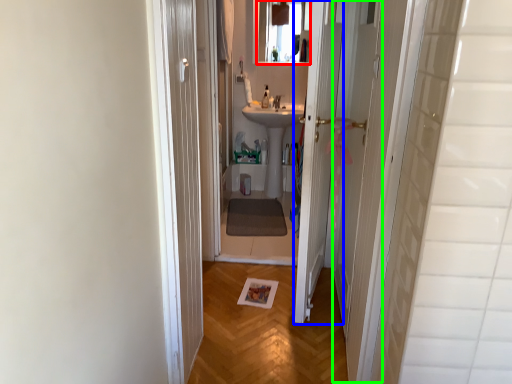
Question: Based on their relative distances, which object is nearer to mirror (highlighted by a red box)? Choose from door (highlighted by a blue box) and screen door (highlighted by a green box).

Choices:
 (A) door
 (B) screen door

Answer: (B)